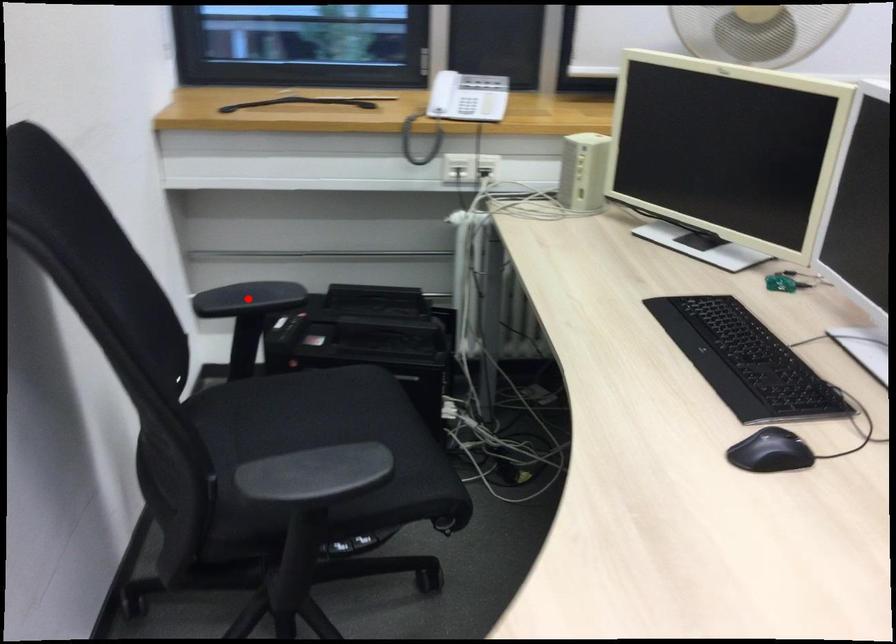
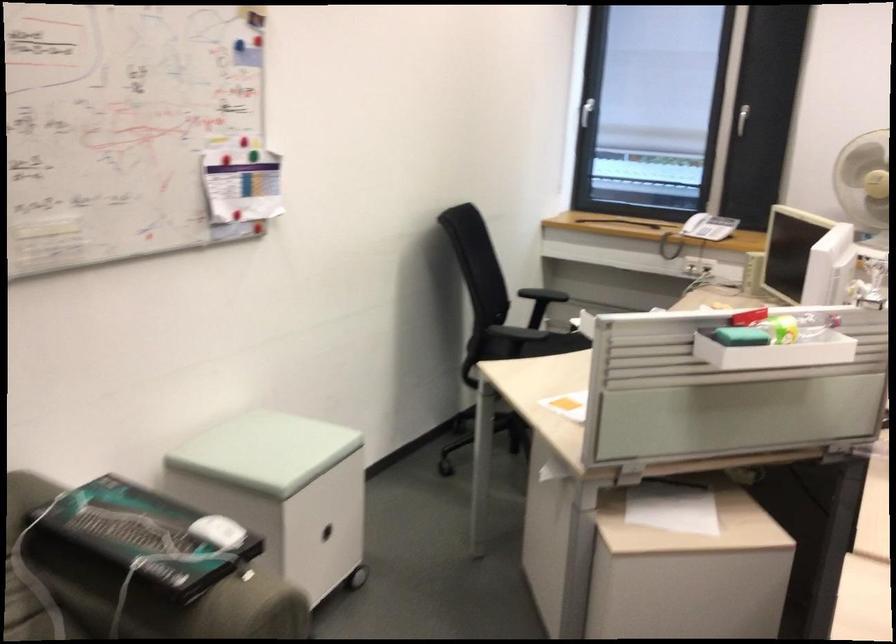
Question: I am providing you with two images of the same scene from different viewpoints. A red point is marked on the first image. Is the red point's position out of view in image 2?

Choices:
 (A) Yes
 (B) No

Answer: (A)